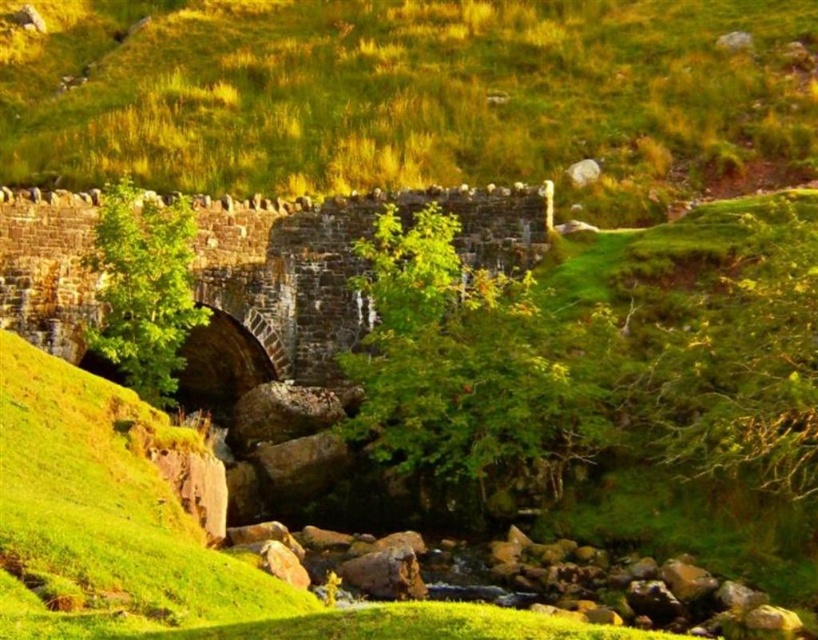
Is green grassy at center wider than brown stone bridge at center?

Yes.

Is green grassy at center positioned at the back of brown stone bridge at center?

That is True.

Which is behind, point (769, 86) or point (318, 275)?

Point (769, 86)

At what (x,y) coordinates should I click in order to perform the action: click on green grassy at center. Please return your answer as a coordinate pair (x, y). The width and height of the screenshot is (818, 640). Looking at the image, I should click on (421, 93).